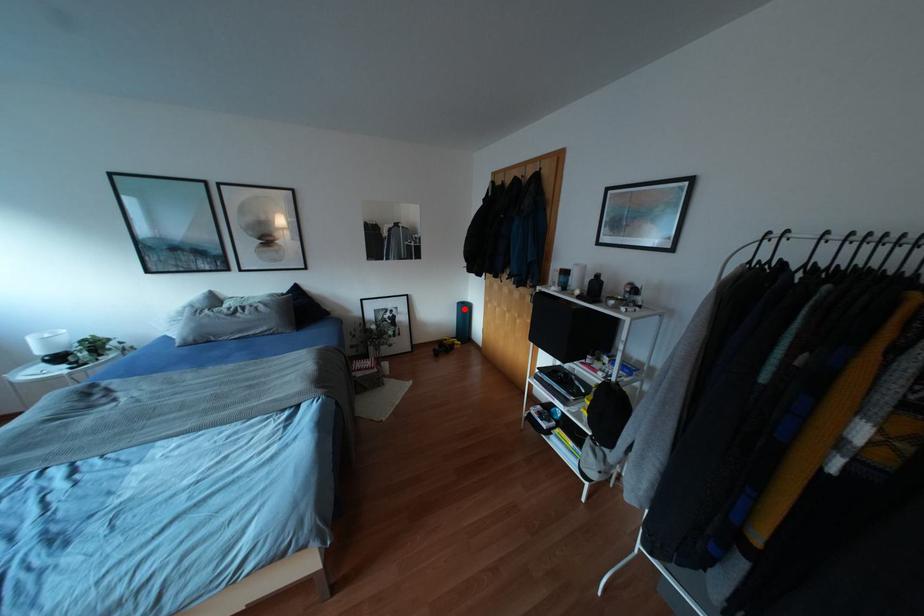
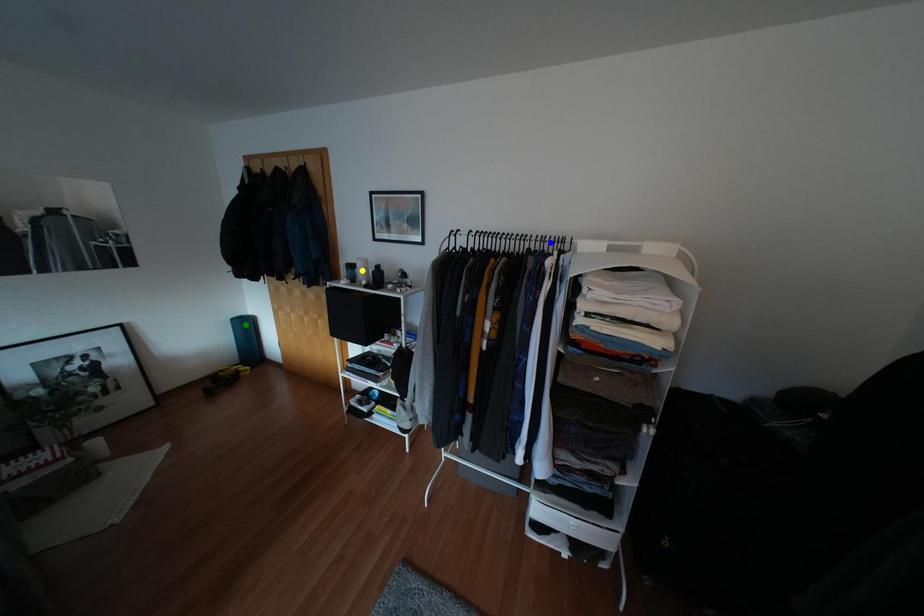
Question: I am providing you with two images of the same scene from different viewpoints. A red point is marked on the first image. You are given multiple points on the second image. Which mark in image 2 goes with the point in image 1?

Choices:
 (A) blue point
 (B) green point
 (C) yellow point

Answer: (B)